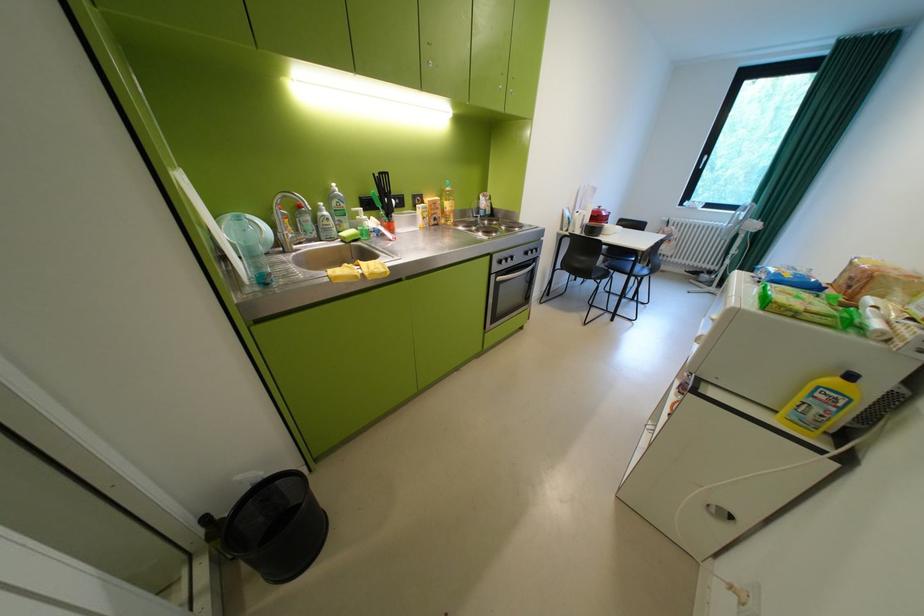
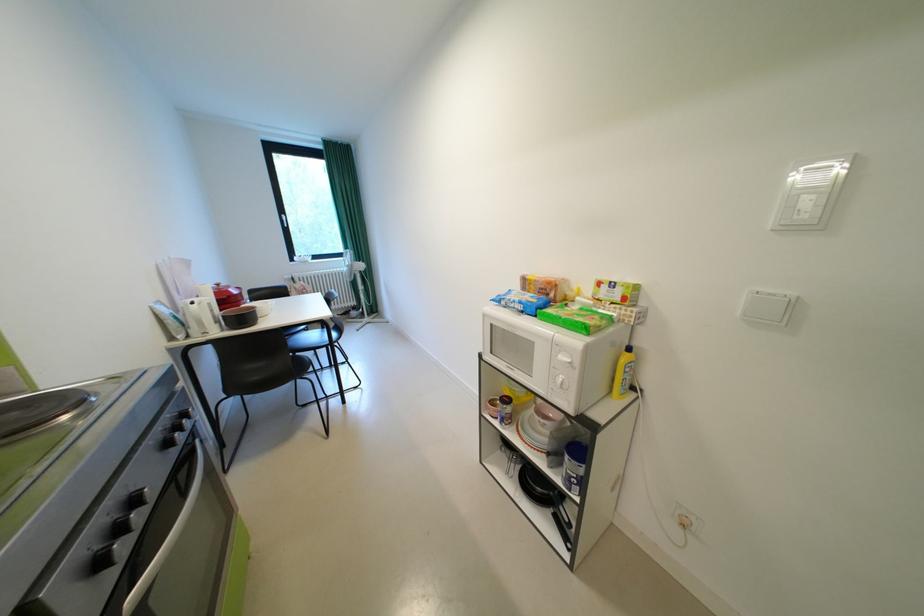
Question: The images are taken continuously from a first-person perspective. In which direction is your viewpoint rotating?

Choices:
 (A) Left
 (B) Right
 (C) Up
 (D) Down

Answer: (B)